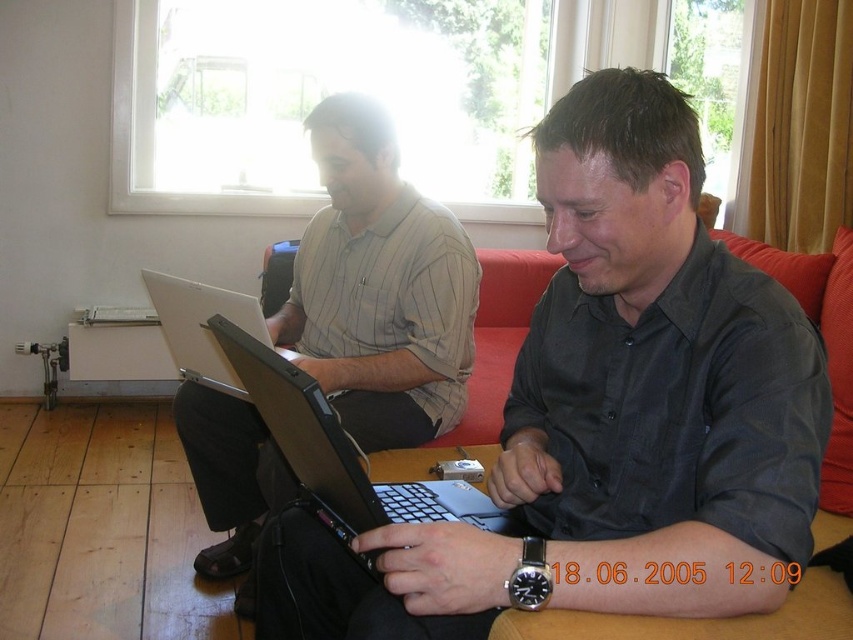
Question: In this image, where is black matte laptop at center located relative to silver metallic laptop at center?

Choices:
 (A) below
 (B) above

Answer: (A)

Question: Which object is positioned closest to the matte gray shirt at center?

Choices:
 (A) silver metallic laptop at center
 (B) matte black laptop at center

Answer: (A)

Question: Which of the following is the closest to the observer?

Choices:
 (A) [151, 280]
 (B) [212, 332]
 (C) [436, 582]

Answer: (C)

Question: Is matte black laptop at center thinner than matte gray shirt at center?

Choices:
 (A) no
 (B) yes

Answer: (B)

Question: Among these points, which one is nearest to the camera?

Choices:
 (A) (611, 611)
 (B) (341, 536)

Answer: (A)

Question: Can you confirm if black matte laptop at center is wider than silver metallic laptop at center?

Choices:
 (A) no
 (B) yes

Answer: (B)